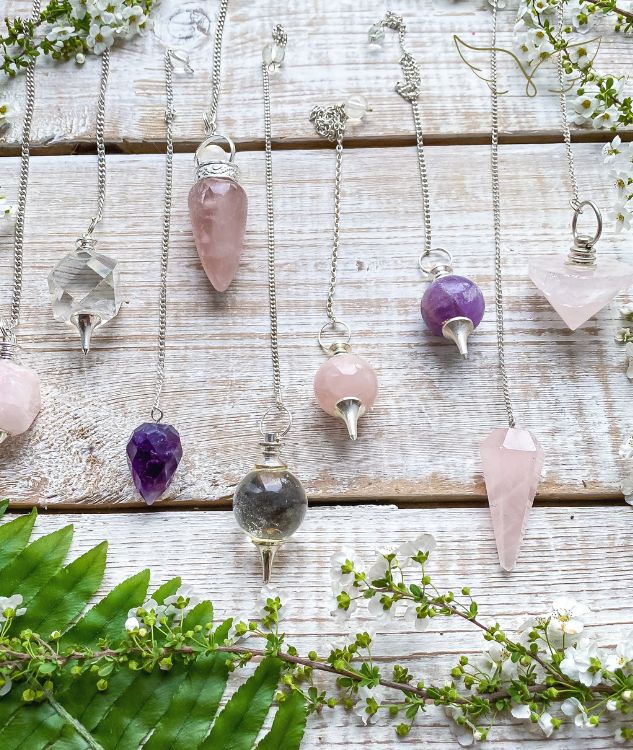
You are a GUI agent. You are given a task and a screenshot of the screen. Output one action in this format:
    pyautogui.click(x=<x>, y=<y>)
    Task: Click on the wood plank surface
    Image resolution: width=633 pixels, height=750 pixels.
    Given the screenshot: What is the action you would take?
    (x=475, y=535), (x=452, y=391), (x=332, y=46), (x=332, y=316)